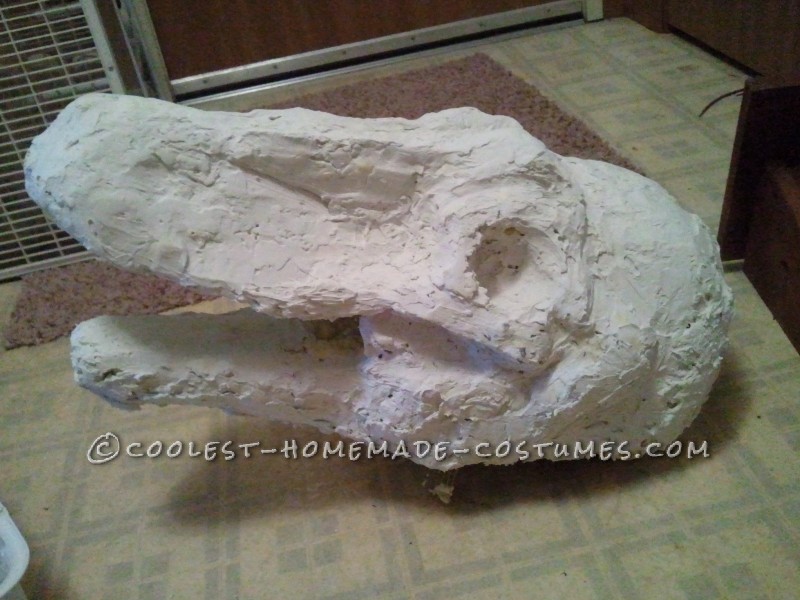
The width and height of the screenshot is (800, 600). Identify the location of floor. (518, 538), (646, 90).